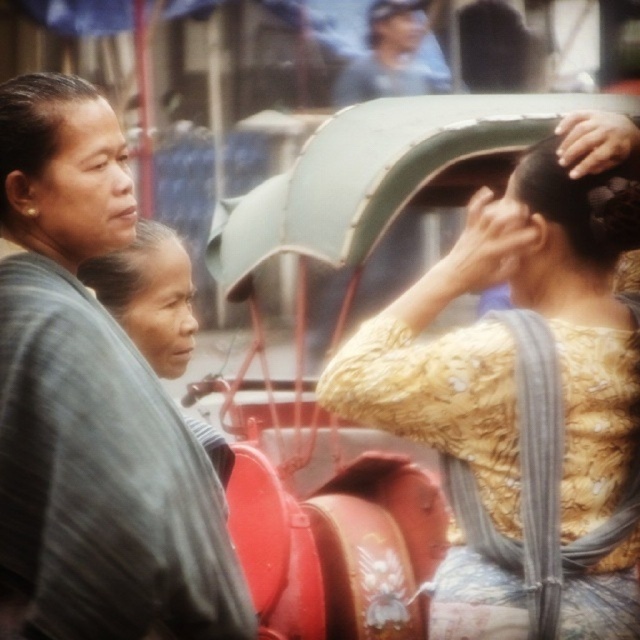
Which is behind, point (38, 90) or point (417, 60)?

The point (417, 60) is more distant.

Is matte gray head at upper left wider than matte blue shirt at upper center?

Incorrect, matte gray head at upper left's width does not surpass matte blue shirt at upper center's.

Which is in front, point (19, 177) or point (401, 4)?

Point (19, 177)

Find the location of a particular element. This screenshot has height=640, width=640. matte gray head at upper left is located at coordinates (61, 170).

Who is positioned more to the left, golden textured hair at upper right or smooth skin head at upper center?

smooth skin head at upper center

Between golden textured hair at upper right and smooth skin head at upper center, which one is positioned higher?

Positioned higher is smooth skin head at upper center.

Is point (531, 188) positioned in front of point (404, 28)?

Yes, it is.

Identify the location of golden textured hair at upper right. This screenshot has height=640, width=640. (582, 202).

Does yellow textured blouse at center have a smaller size compared to matte gray head at upper left?

No, yellow textured blouse at center is not smaller than matte gray head at upper left.

Which is below, yellow textured blouse at center or matte gray head at upper left?

yellow textured blouse at center

Find the location of a particular element. yellow textured blouse at center is located at coordinates (522, 406).